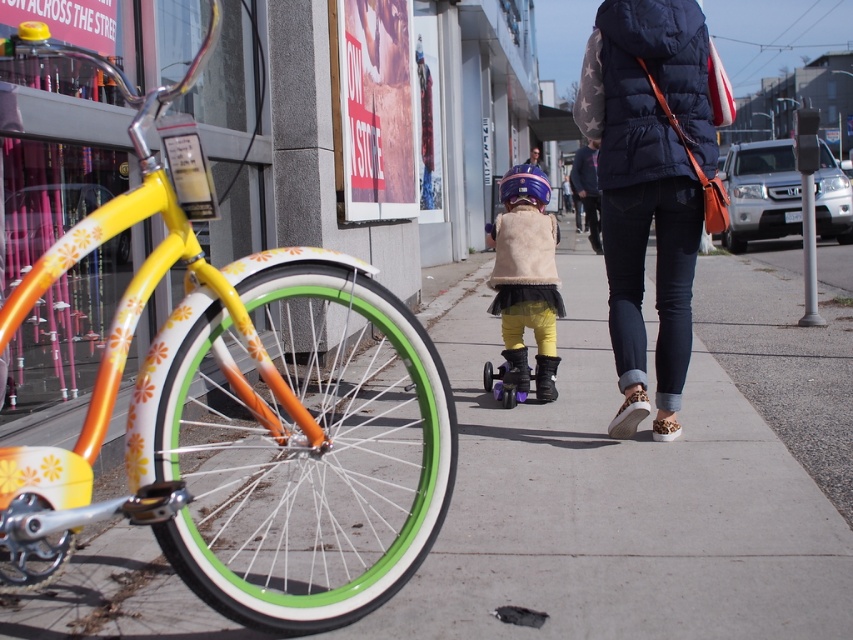
What is the exact coordinate of the concrete sidewalk at center?

The concrete sidewalk at center is located at coordinate point (643, 474).

You are standing on the sidewalk and see two points marked on the ground. The first point is at coordinates point (508, 282) and the second is at point (491, 372). Which point is closer to you?

Point (508, 282) is closer to the viewer than point (491, 372).

You are a delivery person who needs to place a beige faux fur vest at center and a purple matte roller skate at center into a storage box. The box can only hold items where the larger item is placed first. Which item should you place first?

The beige faux fur vest at center is larger in size than the purple matte roller skate at center, so you should place the beige faux fur vest at center first to ensure proper storage.